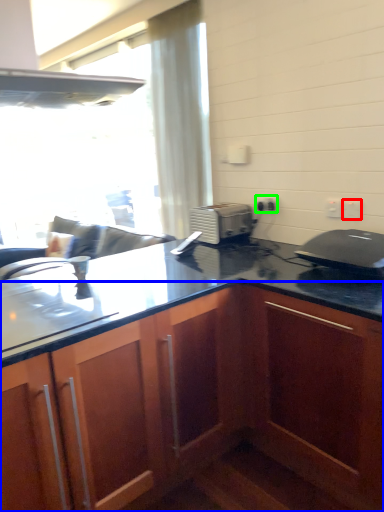
Question: Estimate the real-world distances between objects in this image. Which object is closer to electric outlet (highlighted by a red box), cabinetry (highlighted by a blue box) or electric outlet (highlighted by a green box)?

Choices:
 (A) cabinetry
 (B) electric outlet

Answer: (B)